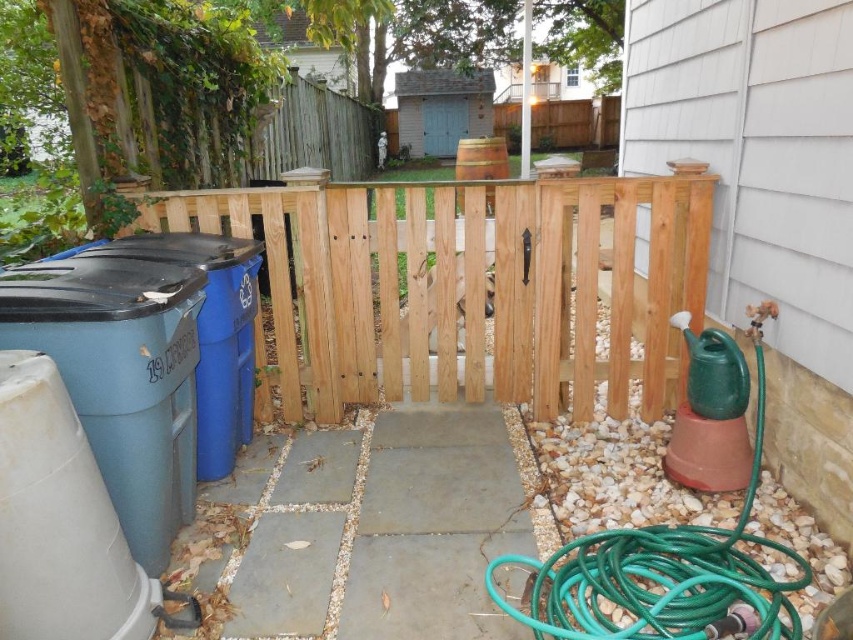
You are standing in the backyard and want to walk from the wooden gate to the white cylindrical object. Which point, point (332, 212) or point (595, 572), is closer to your starting position at the wooden gate?

Point (332, 212) is closer to the wooden gate because it is further to the viewer compared to point (595, 572).

From the picture: You are a gardener who wants to water plants near the wooden barrel at center. You have a green rubber garden hose at right. Which object is closer to you so you can reach it first?

The green rubber garden hose at right is closer to the viewer than the wooden barrel at center, so you can reach it first.